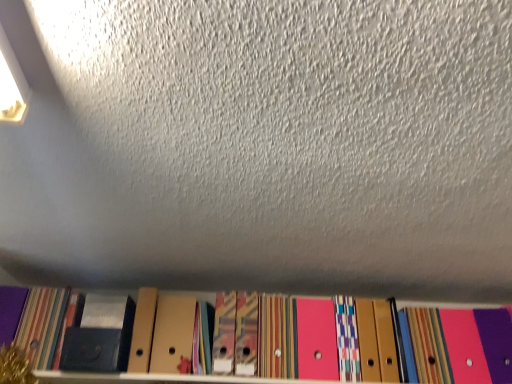
Measure the distance between matte black paperback book at lower left, which appears as the 1th paperback book when viewed from the left, and camera.

They are 4.83 feet apart.

Measure the distance between point (61, 316) and camera.

They are 5.21 feet apart.

Where is `cardboard folders at lower center`? cardboard folders at lower center is located at coordinates (244, 340).

The height and width of the screenshot is (384, 512). What are the coordinates of `matte black paperback book at lower left, the second paperback book positioned from the left` in the screenshot? It's located at (100, 336).

Looking at this image, from a real-world perspective, who is located higher, cardboard folders at lower center or matte black paperback book at lower left, the second paperback book positioned from the left?

matte black paperback book at lower left, the second paperback book positioned from the left, from a real-world perspective.

Would you say cardboard folders at lower center is a long distance from matte black paperback book at lower left, the second paperback book positioned from the left?

cardboard folders at lower center is near matte black paperback book at lower left, the second paperback book positioned from the left, not far away.

Looking at this image, looking at their sizes, would you say cardboard folders at lower center is wider or thinner than matte black paperback book at lower left, which is the first paperback book from right to left?

Clearly, cardboard folders at lower center has more width compared to matte black paperback book at lower left, which is the first paperback book from right to left.

Could you tell me if cardboard folders at lower center is facing matte black paperback book at lower left, the second paperback book positioned from the left?

No.

From the image's perspective, is matte black paperback book at lower left, which is the first paperback book from right to left, positioned above or below matte black paperback book at lower left, which appears as the 1th paperback book when viewed from the left?

matte black paperback book at lower left, which is the first paperback book from right to left, is below matte black paperback book at lower left, which appears as the 1th paperback book when viewed from the left.

Who is bigger, matte black paperback book at lower left, which is the first paperback book from right to left, or matte black paperback book at lower left, the second paperback book when ordered from right to left?

matte black paperback book at lower left, the second paperback book when ordered from right to left.

Between matte black paperback book at lower left, the second paperback book positioned from the left, and matte black paperback book at lower left, the second paperback book when ordered from right to left, which one has smaller width?

Thinner between the two is matte black paperback book at lower left, the second paperback book when ordered from right to left.

Is matte black paperback book at lower left, which appears as the 1th paperback book when viewed from the left, looking in the opposite direction of matte black paperback book at lower left, which is the first paperback book from right to left?

No, matte black paperback book at lower left, which appears as the 1th paperback book when viewed from the left, is not facing the opposite direction of matte black paperback book at lower left, which is the first paperback book from right to left.

Is matte black paperback book at lower left, which appears as the 1th paperback book when viewed from the left, in front of or behind matte black paperback book at lower left, the second paperback book positioned from the left, in the image?

matte black paperback book at lower left, which appears as the 1th paperback book when viewed from the left, is behind matte black paperback book at lower left, the second paperback book positioned from the left.

Consider the image. Considering the sizes of objects matte black paperback book at lower left, the second paperback book when ordered from right to left, and matte black paperback book at lower left, which is the first paperback book from right to left, in the image provided, who is taller, matte black paperback book at lower left, the second paperback book when ordered from right to left, or matte black paperback book at lower left, which is the first paperback book from right to left,?

With more height is matte black paperback book at lower left, the second paperback book when ordered from right to left.

What's the angular difference between matte black paperback book at lower left, which is the first paperback book from right to left, and cardboard folders at lower center's facing directions?

There is a 4.63-degree angle between the facing directions of matte black paperback book at lower left, which is the first paperback book from right to left, and cardboard folders at lower center.

From a real-world perspective, is matte black paperback book at lower left, the second paperback book positioned from the left, beneath cardboard folders at lower center?

No, from a real-world perspective, matte black paperback book at lower left, the second paperback book positioned from the left, is not below cardboard folders at lower center.

Consider the image. Is matte black paperback book at lower left, the second paperback book positioned from the left, far from cardboard folders at lower center?

matte black paperback book at lower left, the second paperback book positioned from the left, is actually quite close to cardboard folders at lower center.

In the scene shown: Is matte black paperback book at lower left, the second paperback book positioned from the left, at the right side of cardboard folders at lower center?

No.

Is cardboard folders at lower center not near matte black paperback book at lower left, which appears as the 1th paperback book when viewed from the left?

That's not correct — cardboard folders at lower center is a little close to matte black paperback book at lower left, which appears as the 1th paperback book when viewed from the left.

Does cardboard folders at lower center have a larger size compared to matte black paperback book at lower left, which appears as the 1th paperback book when viewed from the left?

Correct, cardboard folders at lower center is larger in size than matte black paperback book at lower left, which appears as the 1th paperback book when viewed from the left.

From the image's perspective, is cardboard folders at lower center below matte black paperback book at lower left, which appears as the 1th paperback book when viewed from the left?

Incorrect, from the image's perspective, cardboard folders at lower center is higher than matte black paperback book at lower left, which appears as the 1th paperback book when viewed from the left.

From the cardboard folders at lower center, count the 2nd paperback book to the left and point to it. Please provide its 2D coordinates.

[(42, 324)]

Between matte black paperback book at lower left, the second paperback book when ordered from right to left, and cardboard folders at lower center, which one has less height?

cardboard folders at lower center.

Considering the relative positions of matte black paperback book at lower left, the second paperback book when ordered from right to left, and cardboard folders at lower center in the image provided, is matte black paperback book at lower left, the second paperback book when ordered from right to left, in front of cardboard folders at lower center?

No, it is behind cardboard folders at lower center.

Can you confirm if matte black paperback book at lower left, which appears as the 1th paperback book when viewed from the left, is positioned to the right of cardboard folders at lower center?

Incorrect, matte black paperback book at lower left, which appears as the 1th paperback book when viewed from the left, is not on the right side of cardboard folders at lower center.

Is matte black paperback book at lower left, the second paperback book when ordered from right to left, with cardboard folders at lower center?

There is a gap between matte black paperback book at lower left, the second paperback book when ordered from right to left, and cardboard folders at lower center.

From a real-world perspective, which paperback book is the 1st one above the cardboard folders at lower center? Please provide its 2D coordinates.

[(100, 336)]

This screenshot has height=384, width=512. I want to click on paperback book in front of the matte black paperback book at lower left, which appears as the 1th paperback book when viewed from the left, so click(100, 336).

When comparing their distances from matte black paperback book at lower left, the second paperback book when ordered from right to left, does cardboard folders at lower center or matte black paperback book at lower left, the second paperback book positioned from the left, seem closer?

Based on the image, matte black paperback book at lower left, the second paperback book positioned from the left, appears to be nearer to matte black paperback book at lower left, the second paperback book when ordered from right to left.

Which object lies nearer to the anchor point cardboard folders at lower center, matte black paperback book at lower left, the second paperback book positioned from the left, or matte black paperback book at lower left, the second paperback book when ordered from right to left?

Based on the image, matte black paperback book at lower left, the second paperback book positioned from the left, appears to be nearer to cardboard folders at lower center.

From the picture: From the image, which object appears to be nearer to matte black paperback book at lower left, which is the first paperback book from right to left, matte black paperback book at lower left, the second paperback book when ordered from right to left, or cardboard folders at lower center?

Based on the image, matte black paperback book at lower left, the second paperback book when ordered from right to left, appears to be nearer to matte black paperback book at lower left, which is the first paperback book from right to left.

From the image, which object appears to be farther from matte black paperback book at lower left, the second paperback book when ordered from right to left, matte black paperback book at lower left, which is the first paperback book from right to left, or cardboard folders at lower center?

cardboard folders at lower center is positioned further to the anchor matte black paperback book at lower left, the second paperback book when ordered from right to left.

Looking at this image, looking at the image, which one is located further to cardboard folders at lower center, matte black paperback book at lower left, which appears as the 1th paperback book when viewed from the left, or matte black paperback book at lower left, the second paperback book positioned from the left?

Among the two, matte black paperback book at lower left, which appears as the 1th paperback book when viewed from the left, is located further to cardboard folders at lower center.

Estimate the real-world distances between objects in this image. Which object is closer to matte black paperback book at lower left, which is the first paperback book from right to left, cardboard folders at lower center or matte black paperback book at lower left, the second paperback book when ordered from right to left?

Among the two, matte black paperback book at lower left, the second paperback book when ordered from right to left, is located nearer to matte black paperback book at lower left, which is the first paperback book from right to left.

The width and height of the screenshot is (512, 384). In order to click on paperback book between cardboard folders at lower center and matte black paperback book at lower left, which appears as the 1th paperback book when viewed from the left, in the front-back direction in this screenshot , I will do `click(100, 336)`.